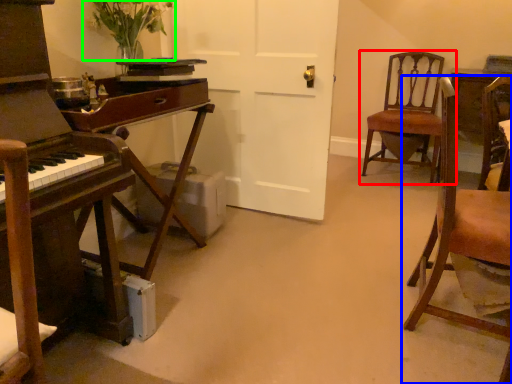
Question: Based on their relative distances, which object is farther from chair (highlighted by a red box)? Choose from chair (highlighted by a blue box) and floral arrangement (highlighted by a green box).

Choices:
 (A) chair
 (B) floral arrangement

Answer: (B)